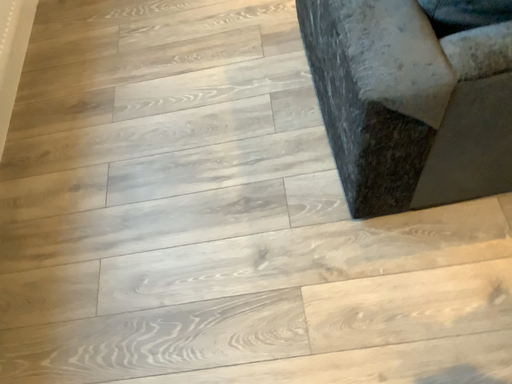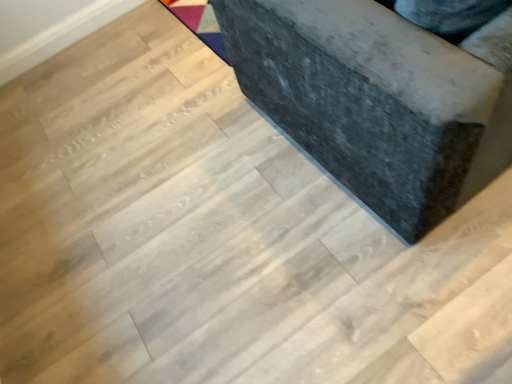
Question: How did the camera likely rotate when shooting the video?

Choices:
 (A) rotated upward
 (B) rotated downward

Answer: (A)